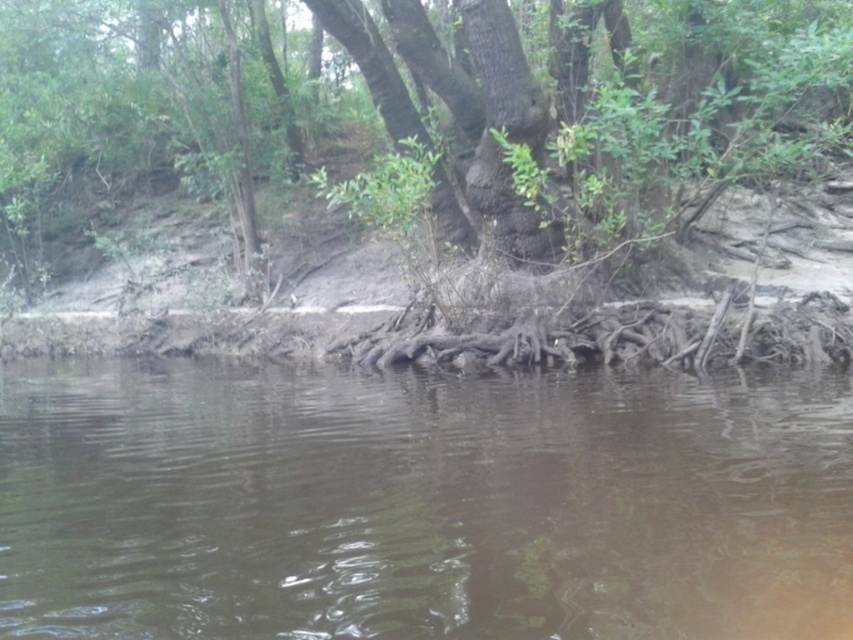
You are standing at the edge of the scene and want to determine which object is taller between the brown muddy water at center and the rough bark tree at center. Based on the scene description, which one is taller?

The rough bark tree at center is taller than the brown muddy water at center.

You are standing at the edge of the scene and want to reach the dense green foliage in the background. Which direction should you move relative to the brown muddy water at center?

To reach the dense green foliage in the background, you should move away from the brown muddy water at center since the foliage is located behind the water in the scene.

You are standing at the edge of the scene and want to walk towards the rough bark tree at center. Which direction should you move to get closer to it without stepping into the brown muddy water at center?

You should move to the side, either left or right, away from the brown muddy water at center, since the brown muddy water at center is closer to you than the rough bark tree at center.